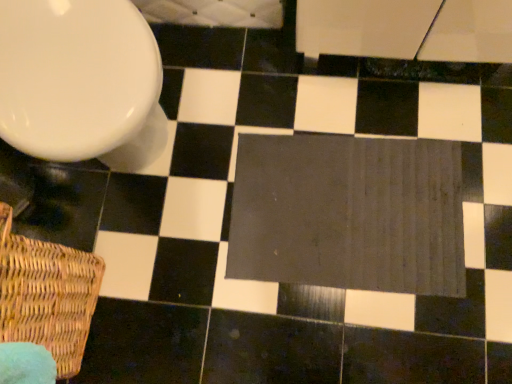
Locate an element on the screen. This screenshot has height=384, width=512. free space to the back side of dark gray fabric bath mat at center is located at coordinates (281, 92).